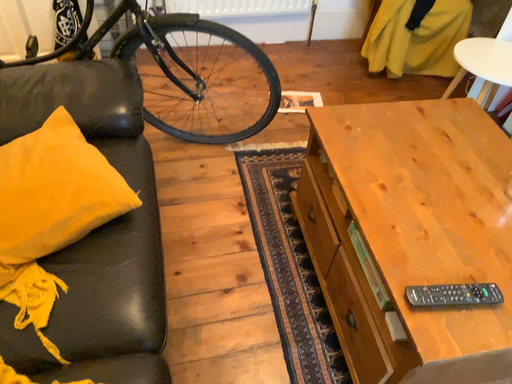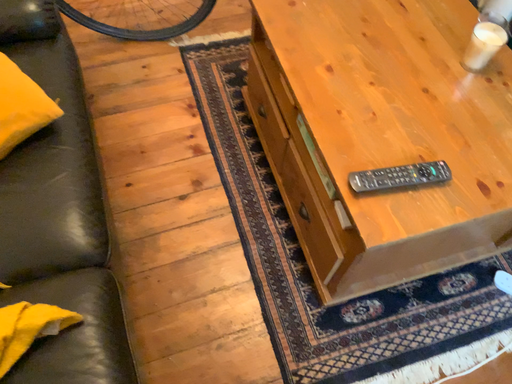
Question: Which way did the camera rotate in the video?

Choices:
 (A) rotated downward
 (B) rotated upward

Answer: (A)